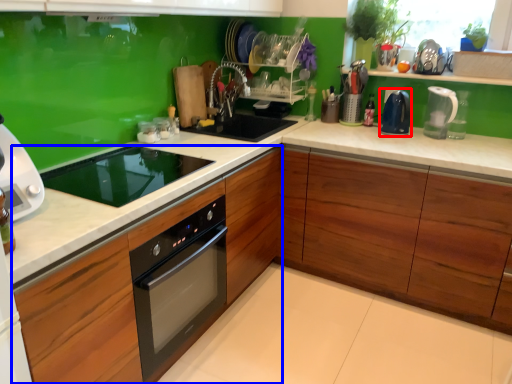
Question: Among these objects, which one is nearest to the camera, kitchen appliance (highlighted by a red box) or cabinetry (highlighted by a blue box)?

Choices:
 (A) kitchen appliance
 (B) cabinetry

Answer: (B)